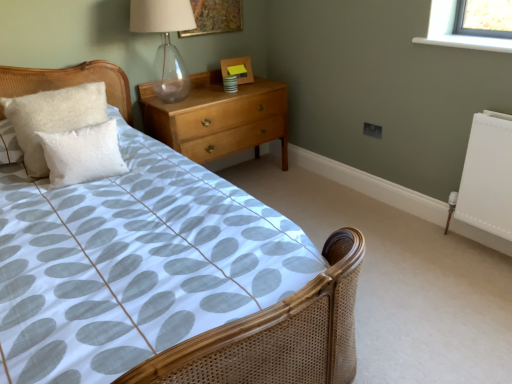
Identify the location of vacant space to the right of light wood/dark finish chest of drawers at upper center. (312, 192).